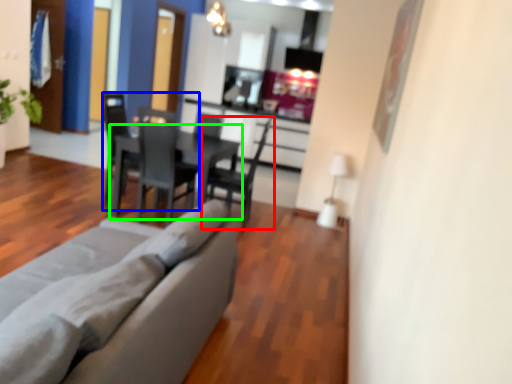
Question: Which object is positioned closest to chair (highlighted by a red box)? Select from chair (highlighted by a blue box) and table (highlighted by a green box).

Choices:
 (A) chair
 (B) table

Answer: (B)